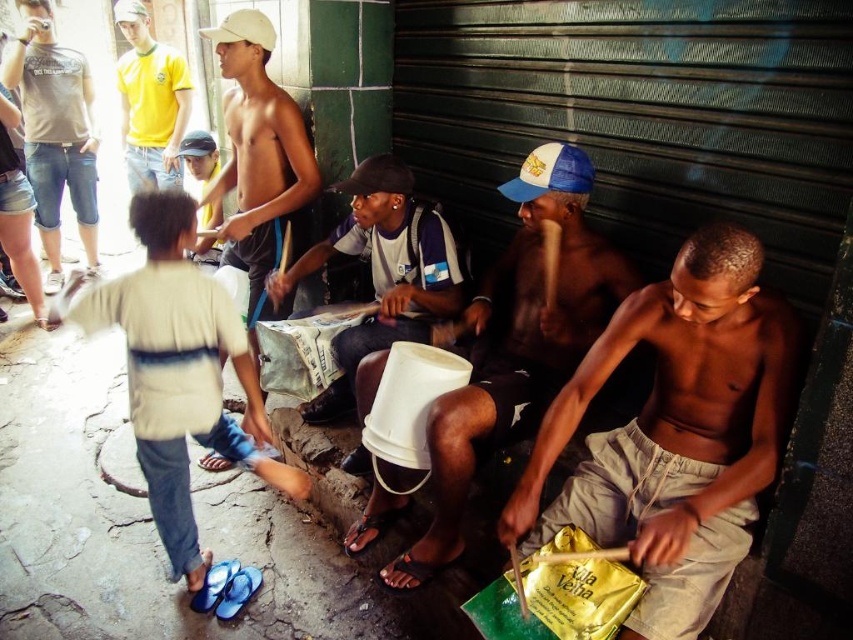
You are a photographer standing at the center of the street scene. You want to take a photo that includes both the black fabric cap at center and the black fabric cap at upper left. Given the distance between them, will you need to zoom out your camera lens to ensure both are in the frame?

The distance between the black fabric cap at center and the black fabric cap at upper left is 7.70 feet. To include both in the frame, you would need to zoom out your camera lens to accommodate the 7.70 feet gap between them.

Please provide the coordinates of the shiny metallic boy at center in the image. The coordinates should be in the format of a point with two decimal places separated by a comma.

The coordinates of the shiny metallic boy at center are at point [675,433].